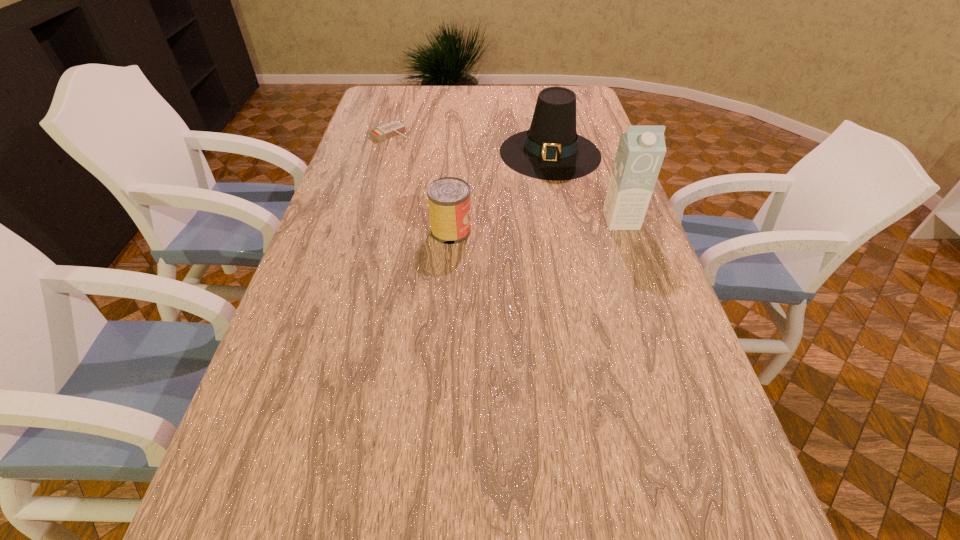
Image resolution: width=960 pixels, height=540 pixels. Identify the location of free space on the desktop that is between the third tallest object and the tallest object and is positioned on the striking surface of the shortest object. (521, 226).

Locate an element on the screen. free spot on the desktop that is between the second shortest object and the carton and is positioned on the front-facing side of the hat is located at coordinates click(529, 226).